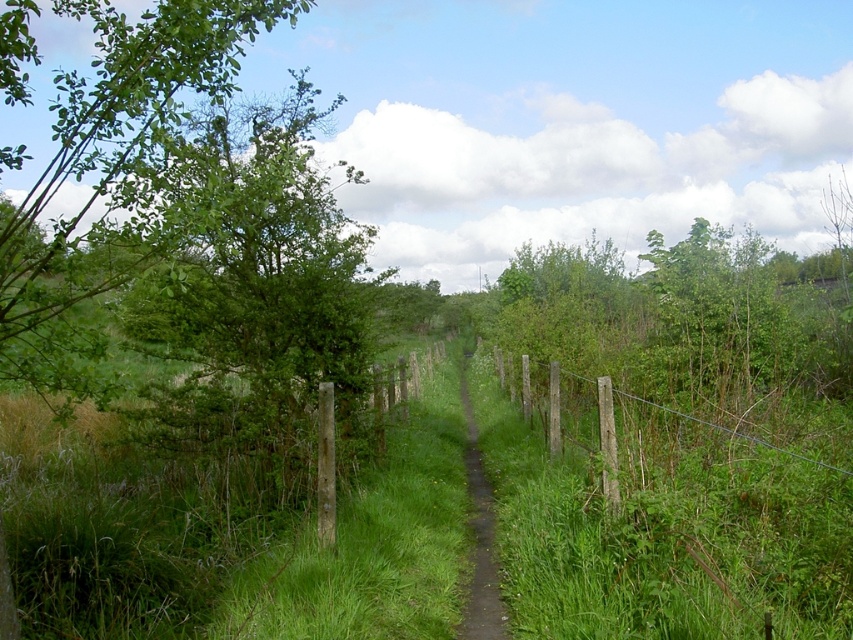
The image size is (853, 640). Describe the element at coordinates (254, 292) in the screenshot. I see `green leafy tree at left` at that location.

Is green leafy tree at left positioned at the back of dirt path at center?

No, it is not.

Is point (219, 401) closer to viewer compared to point (471, 618)?

No, (219, 401) is behind (471, 618).

You are a GUI agent. You are given a task and a screenshot of the screen. Output one action in this format:
    pyautogui.click(x=<x>, y=<y>)
    Task: Click on the green leafy tree at left
    This screenshot has height=640, width=853.
    Given the screenshot: What is the action you would take?
    pyautogui.click(x=254, y=292)

Is point (474, 449) less distant than point (553, 371)?

No, (474, 449) is behind (553, 371).

Does dirt path at center appear on the left side of wooden post fence at right?

Yes, dirt path at center is to the left of wooden post fence at right.

The width and height of the screenshot is (853, 640). Describe the element at coordinates (479, 532) in the screenshot. I see `dirt path at center` at that location.

You are a GUI agent. You are given a task and a screenshot of the screen. Output one action in this format:
    pyautogui.click(x=<x>, y=<y>)
    Task: Click on the dirt path at center
    This screenshot has height=640, width=853.
    Given the screenshot: What is the action you would take?
    pyautogui.click(x=479, y=532)

Is green leafy tree at left in front of wooden post fence at right?

Yes, green leafy tree at left is closer to the viewer.

Is green leafy tree at left to the right of wooden post fence at right from the viewer's perspective?

No, green leafy tree at left is not to the right of wooden post fence at right.

The height and width of the screenshot is (640, 853). Find the location of `green leafy tree at left`. green leafy tree at left is located at coordinates (254, 292).